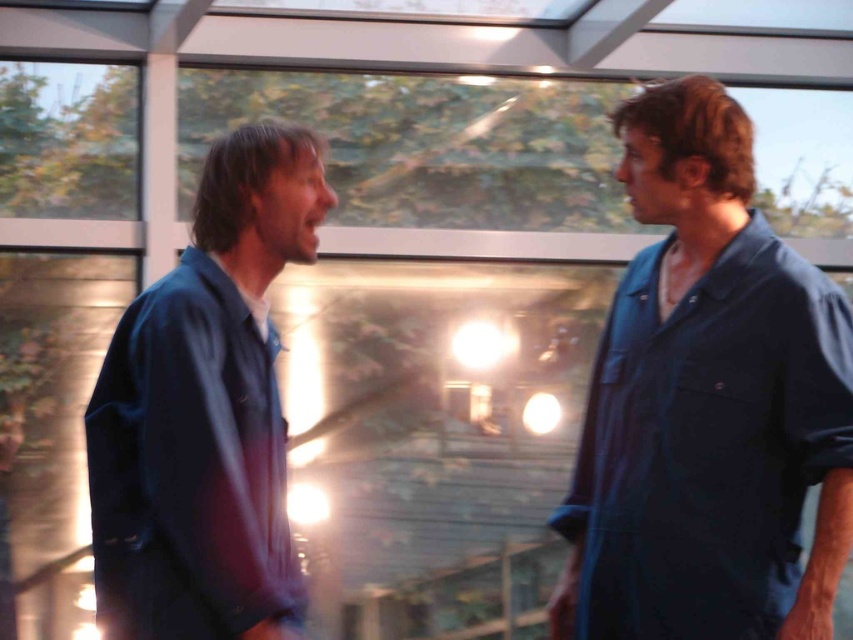
You are a photographer trying to focus on the dark blue shirt at right. You notice a point at coordinates (x=706, y=404) in the image. Is this point located on the dark blue shirt at right?

Yes, the point at (x=706, y=404) is located on the dark blue shirt at right.

You are standing in the room and want to see the outdoor greenery through the large window. Which person, the dark blue shirt at right or the blue cotton shirt at left, is closer to you and thus blocking your view of the window?

The dark blue shirt at right is closer to you than the blue cotton shirt at left, so it is blocking your view of the window.

You are a photographer setting up a shoot in this room. You need to position a light source so that it illuminates both the dark blue shirt at right and the blue cotton shirt at left equally. Considering their heights, where should you place the light source?

The dark blue shirt at right is much taller than the blue cotton shirt at left, so placing the light source at a higher position above both individuals would ensure equal illumination, as the light can reach both tops effectively from above.